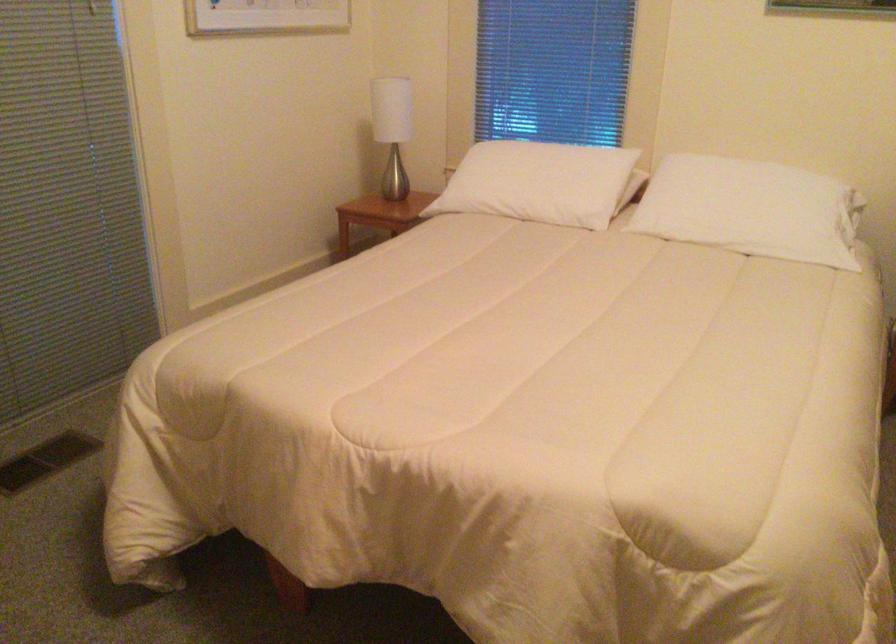
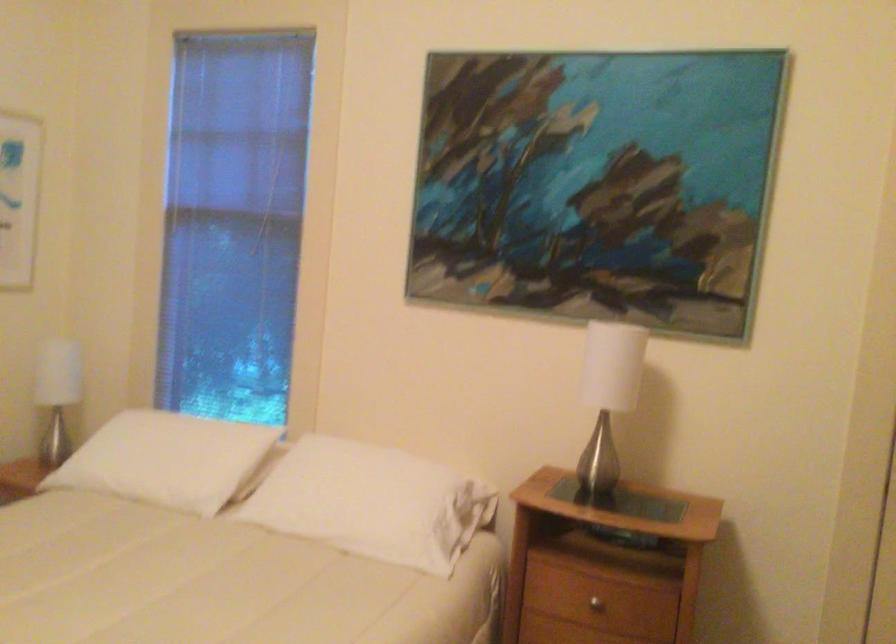
Locate, in the second image, the point that corresponds to [408,131] in the first image.

(56, 393)